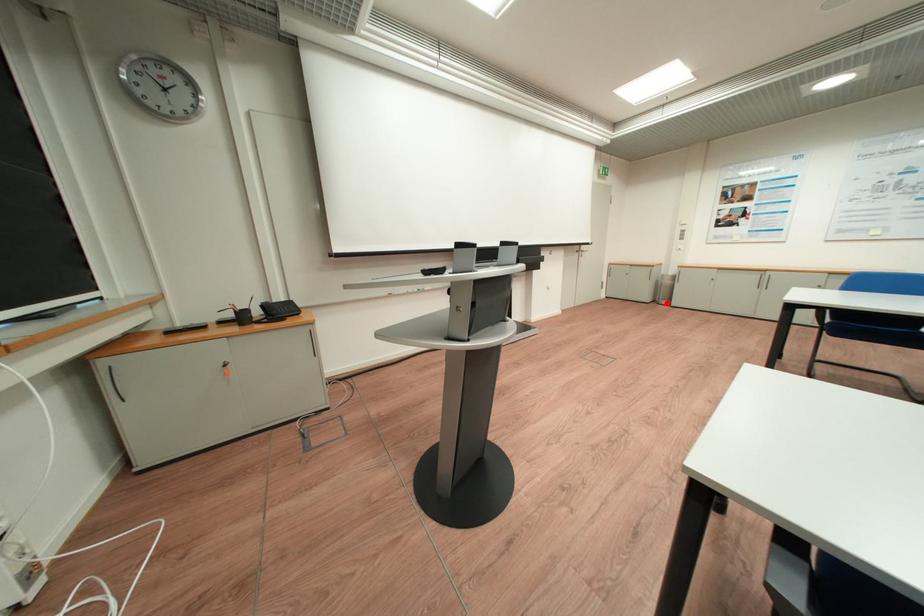
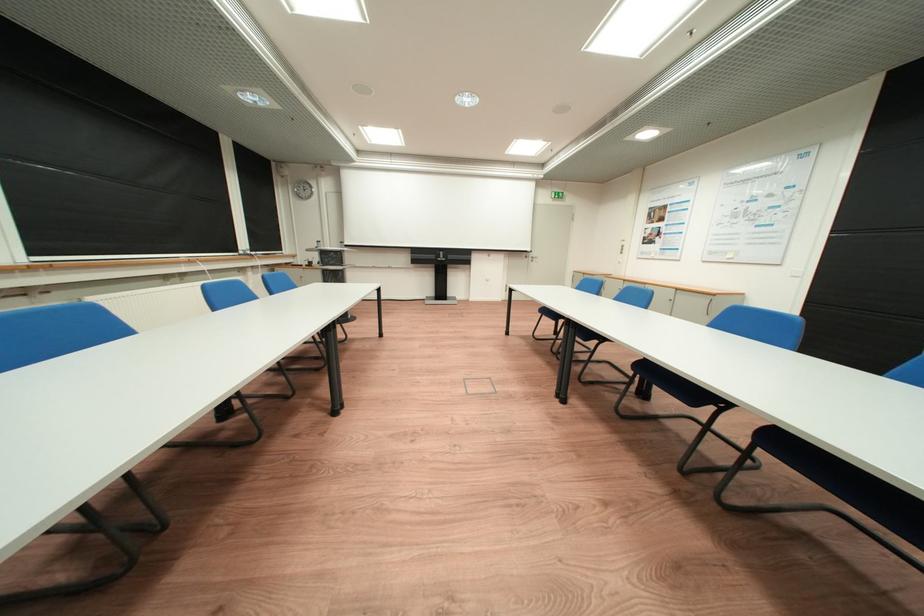
Question: I am providing you with two images of the same scene from different viewpoints. A red point is marked on the first image. Can you still see the location of the red point in image 2?

Choices:
 (A) Yes
 (B) No

Answer: (B)